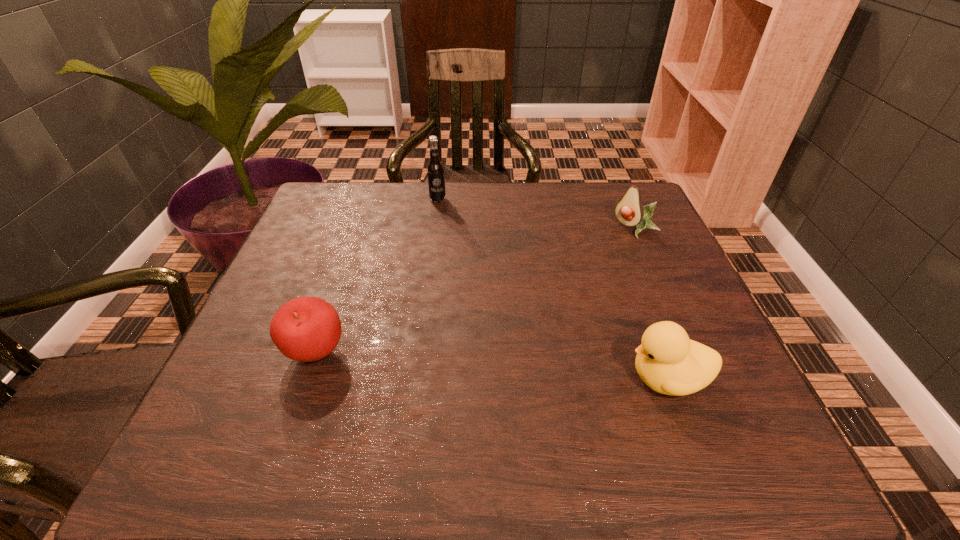
I want to click on duck located at the right edge, so click(667, 361).

This screenshot has height=540, width=960. Identify the location of avocado located at the right edge. (629, 211).

You are a GUI agent. You are given a task and a screenshot of the screen. Output one action in this format:
    pyautogui.click(x=<x>, y=<y>)
    Task: Click on the object positioned at the near left corner
    This screenshot has width=960, height=540.
    Given the screenshot: What is the action you would take?
    pyautogui.click(x=306, y=329)

The height and width of the screenshot is (540, 960). Identify the location of object that is at the far right corner. (629, 211).

Identify the location of object present at the near right corner. (667, 361).

The width and height of the screenshot is (960, 540). I want to click on vacant space at the far edge of the desktop, so click(x=463, y=231).

Find the location of `free space at the near edge of the desktop`. free space at the near edge of the desktop is located at coordinates (391, 380).

In the image, there is a desktop. Where is `free space at the left edge`? free space at the left edge is located at coordinates (315, 283).

At what (x,y) coordinates should I click in order to perform the action: click on vacant space at the right edge of the desktop. Please return your answer as a coordinate pair (x, y). Looking at the image, I should click on (637, 319).

This screenshot has width=960, height=540. Identify the location of vacant space at the far left corner of the desktop. coord(348,185).